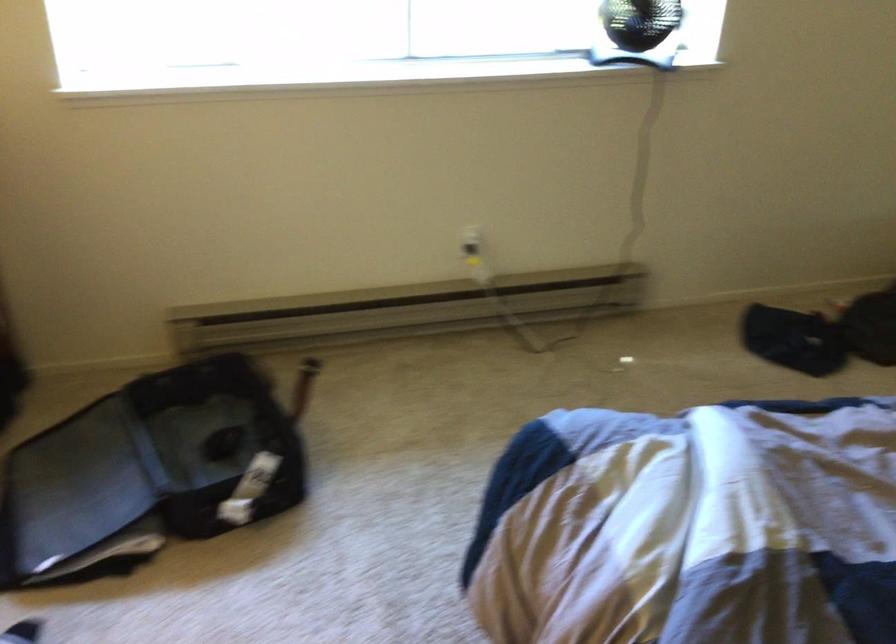
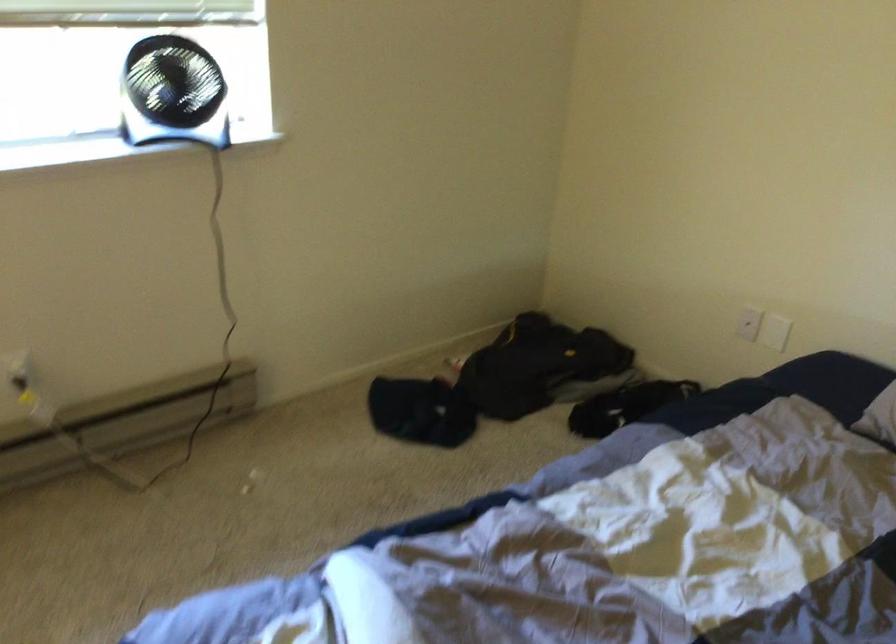
Question: The first image is from the beginning of the video and the second image is from the end. How did the camera likely rotate when shooting the video?

Choices:
 (A) Left
 (B) Right
 (C) Up
 (D) Down

Answer: (B)